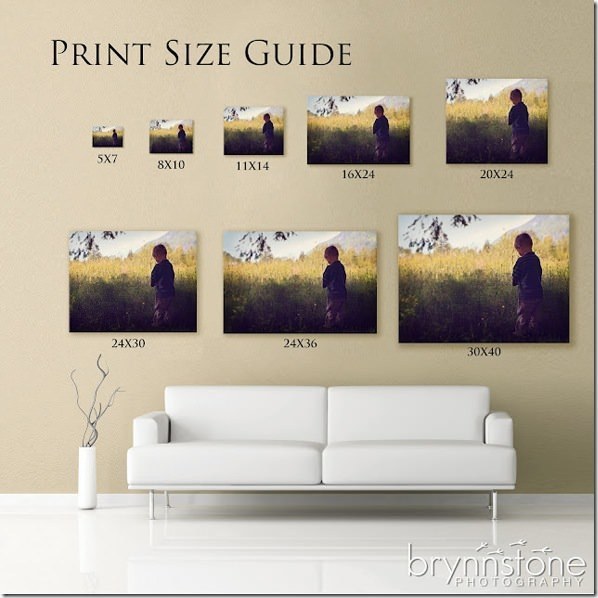
Where is `wall`? This screenshot has width=598, height=598. wall is located at coordinates (39, 392).